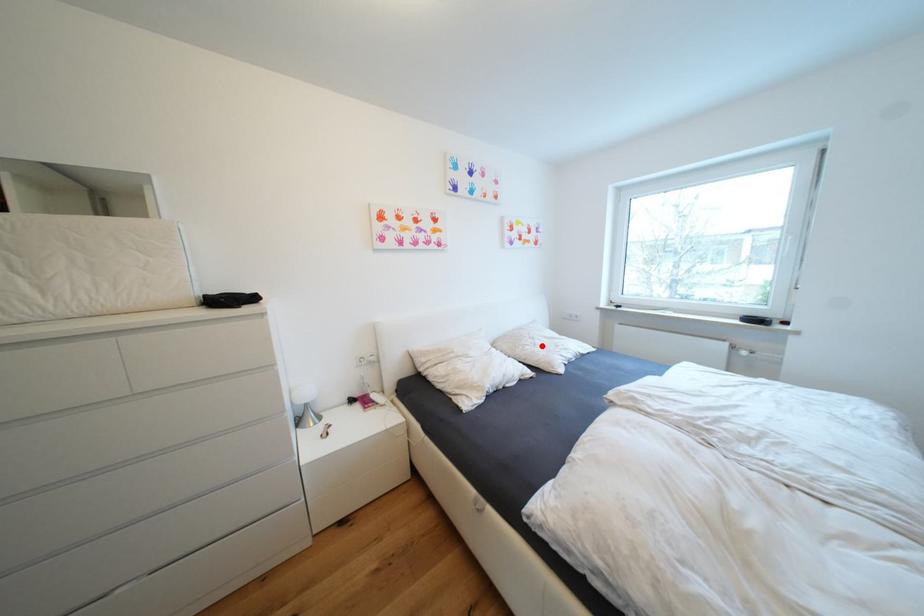
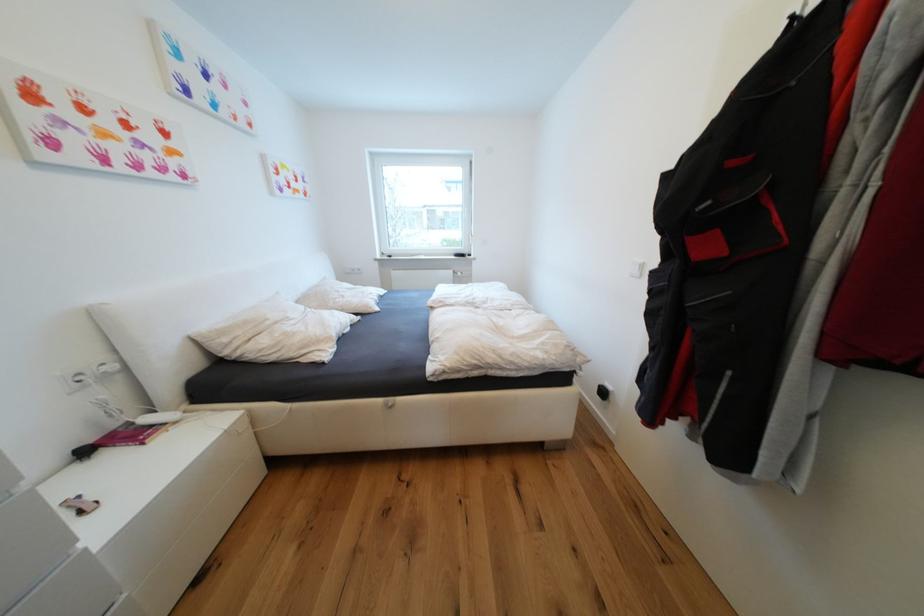
Question: I am providing you with two images of the same scene from different viewpoints. A red point is marked on the first image. At the location where the point appears in image 1, is it still visible in image 2?

Choices:
 (A) Yes
 (B) No

Answer: (A)